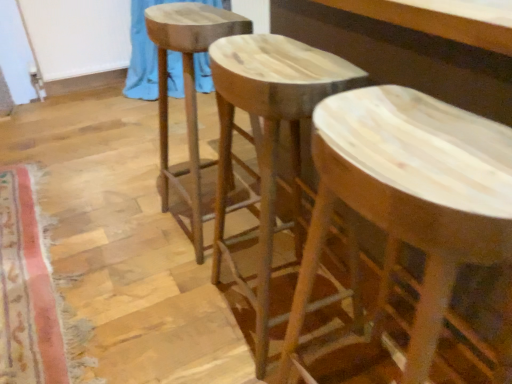
Question: Is the depth of blue fabric at upper left greater than that of natural wood stool at center, marked as the second stool in a left-to-right arrangement?

Choices:
 (A) no
 (B) yes

Answer: (B)

Question: Is blue fabric at upper left next to natural wood stool at center, the 2th stool positioned from the right, and touching it?

Choices:
 (A) yes
 (B) no

Answer: (B)

Question: Does blue fabric at upper left lie in front of natural wood stool at center, the 2th stool positioned from the right?

Choices:
 (A) no
 (B) yes

Answer: (A)

Question: Are blue fabric at upper left and natural wood stool at center, marked as the second stool in a left-to-right arrangement, located far from each other?

Choices:
 (A) yes
 (B) no

Answer: (A)

Question: Considering the relative sizes of blue fabric at upper left and natural wood stool at center, the 2th stool positioned from the right, in the image provided, is blue fabric at upper left wider than natural wood stool at center, the 2th stool positioned from the right,?

Choices:
 (A) no
 (B) yes

Answer: (B)

Question: Can you confirm if blue fabric at upper left is positioned to the left of natural wood stool at center, the 2th stool positioned from the right?

Choices:
 (A) yes
 (B) no

Answer: (A)

Question: From the image's perspective, is natural wood stool at center, arranged as the 1th stool when viewed from the right, located beneath carpeted mat at lower left?

Choices:
 (A) yes
 (B) no

Answer: (A)

Question: Can you confirm if natural wood stool at center, the 3th stool viewed from the left, is wider than carpeted mat at lower left?

Choices:
 (A) yes
 (B) no

Answer: (A)

Question: Is natural wood stool at center, the 3th stool viewed from the left, taller than carpeted mat at lower left?

Choices:
 (A) no
 (B) yes

Answer: (B)

Question: Can you confirm if natural wood stool at center, the 3th stool viewed from the left, is positioned to the right of carpeted mat at lower left?

Choices:
 (A) no
 (B) yes

Answer: (B)

Question: Considering the relative sizes of natural wood stool at center, arranged as the 1th stool when viewed from the right, and carpeted mat at lower left in the image provided, is natural wood stool at center, arranged as the 1th stool when viewed from the right, bigger than carpeted mat at lower left?

Choices:
 (A) no
 (B) yes

Answer: (B)

Question: Is natural wood stool at center, arranged as the 1th stool when viewed from the right, shorter than carpeted mat at lower left?

Choices:
 (A) no
 (B) yes

Answer: (A)

Question: Are natural wood stool at center, the third stool positioned from the right, and carpeted mat at lower left making contact?

Choices:
 (A) yes
 (B) no

Answer: (B)